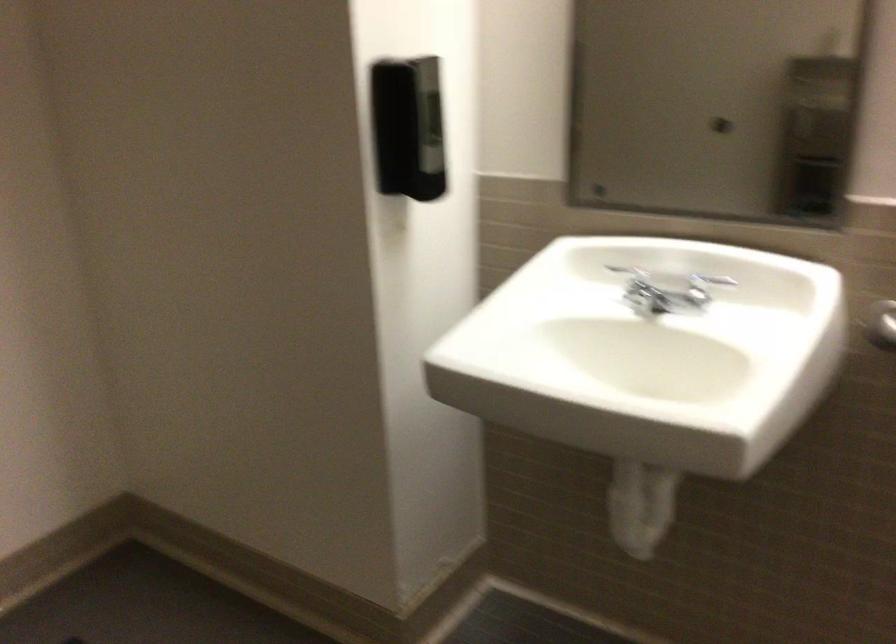
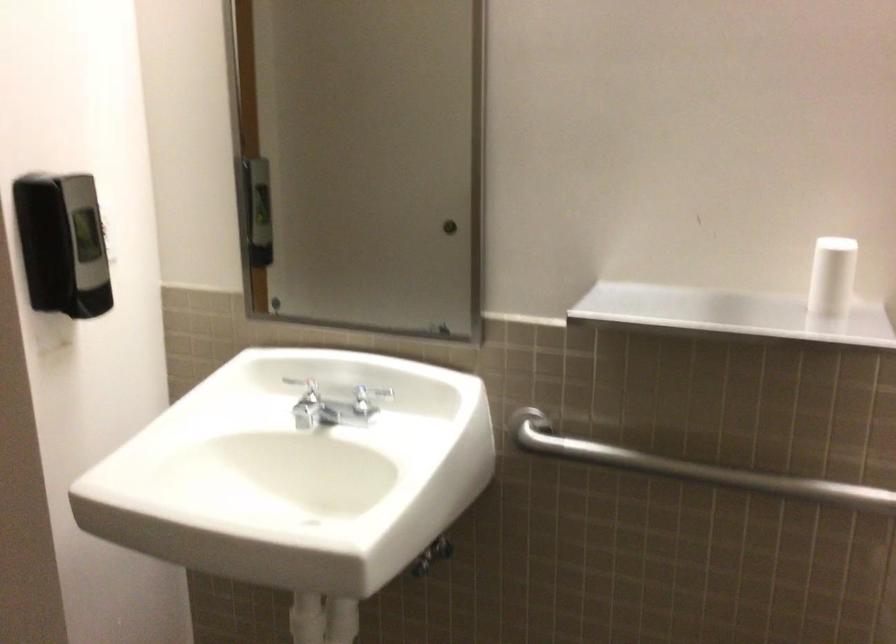
Question: I am providing you with two images of the same scene from different viewpoints. Please identify which objects are invisible in image2.

Choices:
 (A) chrome faucet handle
 (B) drain plug lever
 (C) white paper cup
 (D) none of these

Answer: (D)